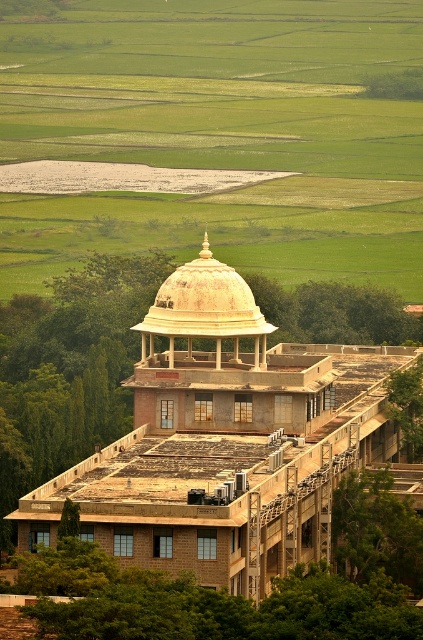
You are a drone operator who needs to fly a drone from the green grass at upper center to the dome structure at the top of the building. The drone has a maximum flight range of 350 meters. Based on the scene description, can the drone reach the dome structure at the top of the building?

The distance between the green grass at upper center and the dome structure at the top of the building is 342.69 meters, which is within the drone operator maximum flight range of 350 meters. The drone can reach the dome structure at the top of the building.